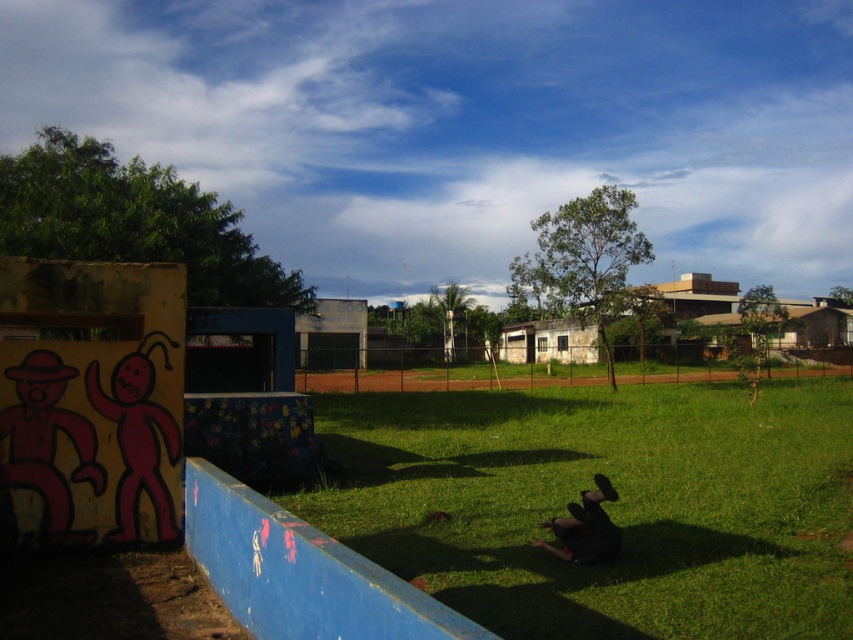
This screenshot has width=853, height=640. What do you see at coordinates (604, 506) in the screenshot? I see `green grass at center` at bounding box center [604, 506].

The width and height of the screenshot is (853, 640). I want to click on green grass at center, so click(x=604, y=506).

Is point (695, 602) in front of point (595, 548)?

Yes, point (695, 602) is in front of point (595, 548).

You are a GUI agent. You are given a task and a screenshot of the screen. Output one action in this format:
    pyautogui.click(x=<x>, y=<y>)
    Task: Click on the green grass at center
    
    Given the screenshot: What is the action you would take?
    pyautogui.click(x=604, y=506)

Which is behind, point (64, 378) or point (606, 518)?

Positioned behind is point (64, 378).

Which is in front, point (44, 493) or point (610, 528)?

Point (610, 528) is in front.

Locate an element on the screen. matte red figure at lower left is located at coordinates (47, 445).

Is point (704, 481) behind point (32, 371)?

That is True.

Can you confirm if green grass at center is positioned to the left of matte red figure at lower left?

In fact, green grass at center is to the right of matte red figure at lower left.

Locate an element on the screen. green grass at center is located at coordinates (604, 506).